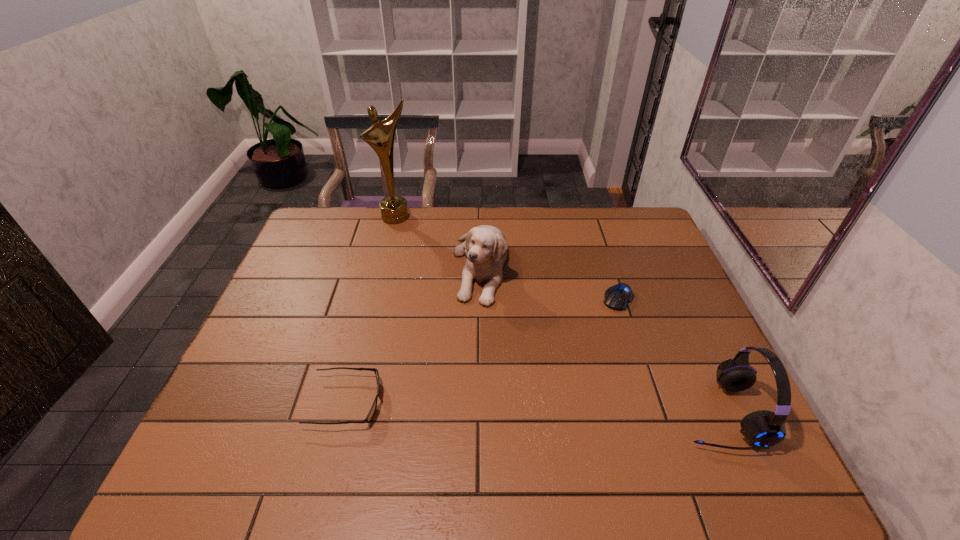
Find the location of a particular element. puppy that is positioned at the far edge is located at coordinates (485, 246).

The width and height of the screenshot is (960, 540). Find the location of `award situated at the far edge`. award situated at the far edge is located at coordinates (380, 136).

Image resolution: width=960 pixels, height=540 pixels. Identify the location of sunglasses situated at the near edge. (371, 413).

Locate an element on the screen. The image size is (960, 540). headset at the near edge is located at coordinates (763, 429).

Identify the location of headset situated at the right edge. (763, 429).

Locate an element on the screen. The image size is (960, 540). computer mouse located at the right edge is located at coordinates tap(617, 297).

Identify the location of object that is at the near right corner. This screenshot has height=540, width=960. (763, 429).

This screenshot has height=540, width=960. Identify the location of blank space at the far edge of the desktop. (459, 216).

In the image, there is a desktop. In order to click on free space at the near edge in this screenshot , I will do `click(631, 425)`.

Locate an element on the screen. vacant space at the left edge is located at coordinates (293, 289).